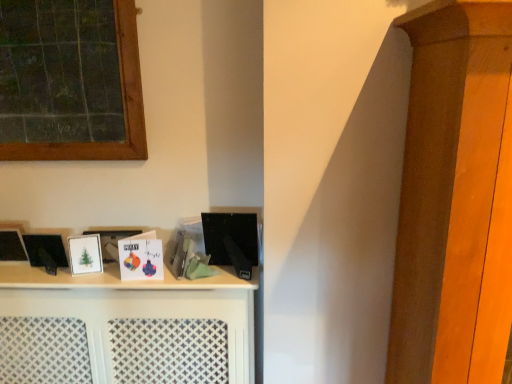
Where is `vacant area that lies in front of white matte picture frame at left`? vacant area that lies in front of white matte picture frame at left is located at coordinates (81, 279).